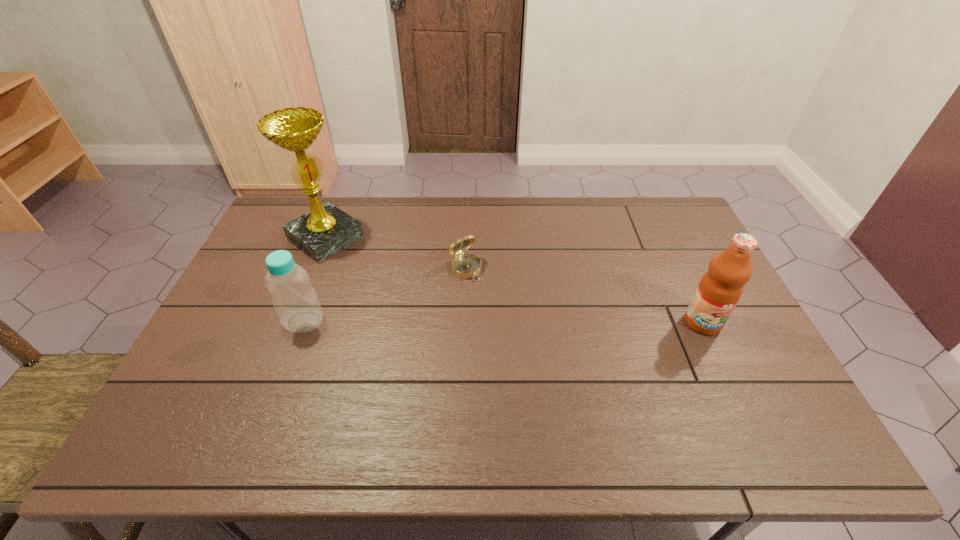
Find the location of a particular element. free area in between the second shortest object and the compass is located at coordinates (385, 295).

At what (x,y) coordinates should I click in order to perform the action: click on vacant area that lies between the tallest object and the bottle. Please return your answer as a coordinate pair (x, y). The width and height of the screenshot is (960, 540). Looking at the image, I should click on 315,280.

This screenshot has width=960, height=540. I want to click on free spot between the third tallest object and the shortest object, so click(385, 295).

Find the location of `free spot between the second object from right to left and the rightmost object`. free spot between the second object from right to left and the rightmost object is located at coordinates pyautogui.click(x=584, y=295).

What are the coordinates of `object that stands as the closest to the award` in the screenshot? It's located at (295, 301).

Identify which object is the third closest to the award. Please provide its 2D coordinates. Your answer should be formatted as a tuple, i.e. [(x, y)], where the tuple contains the x and y coordinates of a point satisfying the conditions above.

[(719, 290)]

Where is `free space that satisfies the following two spatial constraints: 1. on the front side of the award; 2. on the left side of the bottle`? free space that satisfies the following two spatial constraints: 1. on the front side of the award; 2. on the left side of the bottle is located at coordinates pos(293,321).

Where is `free space that satisfies the following two spatial constraints: 1. on the front side of the tallest object; 2. on the right side of the third object from left to right`? The image size is (960, 540). free space that satisfies the following two spatial constraints: 1. on the front side of the tallest object; 2. on the right side of the third object from left to right is located at coordinates [314, 269].